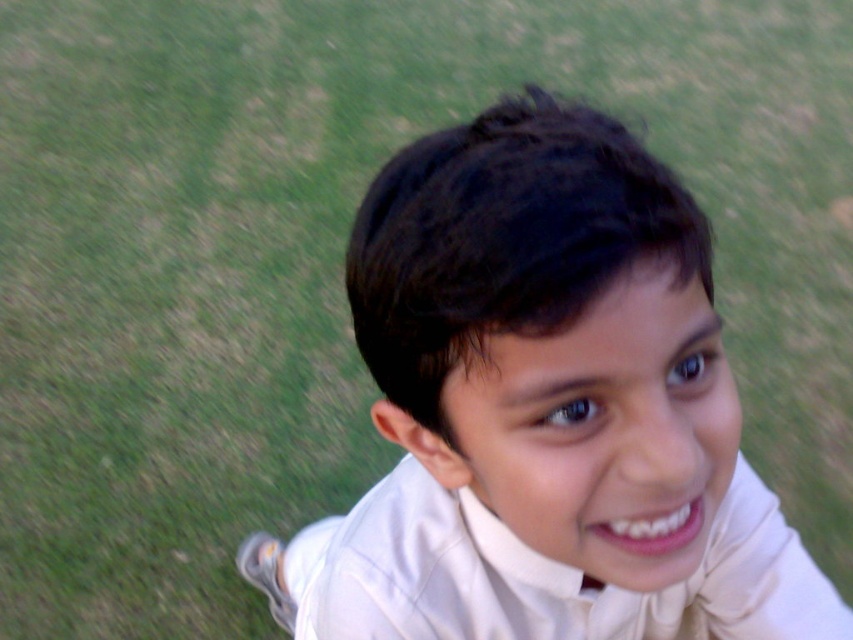
Who is more forward, (495, 124) or (415, 572)?

Point (495, 124) is in front.

Can you confirm if smooth white shirt at center is wider than white satin dress shirt at center?

Incorrect, smooth white shirt at center's width does not surpass white satin dress shirt at center's.

Locate an element on the screen. smooth white shirt at center is located at coordinates (544, 410).

I want to click on smooth white shirt at center, so click(x=544, y=410).